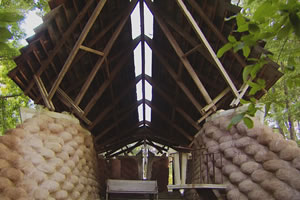
Image resolution: width=300 pixels, height=200 pixels. Identify the location of bench. 136,187.